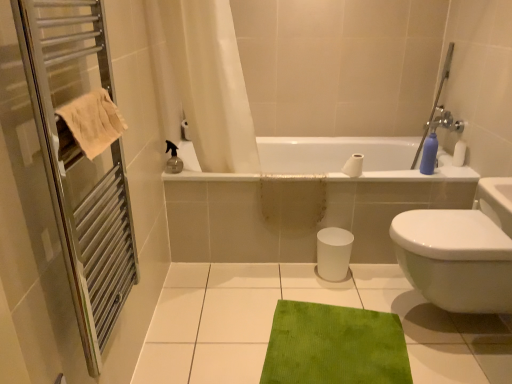
Where is `free area below white glossy bidet at lower right (from a real-world perspective)`? free area below white glossy bidet at lower right (from a real-world perspective) is located at coordinates [x=436, y=319].